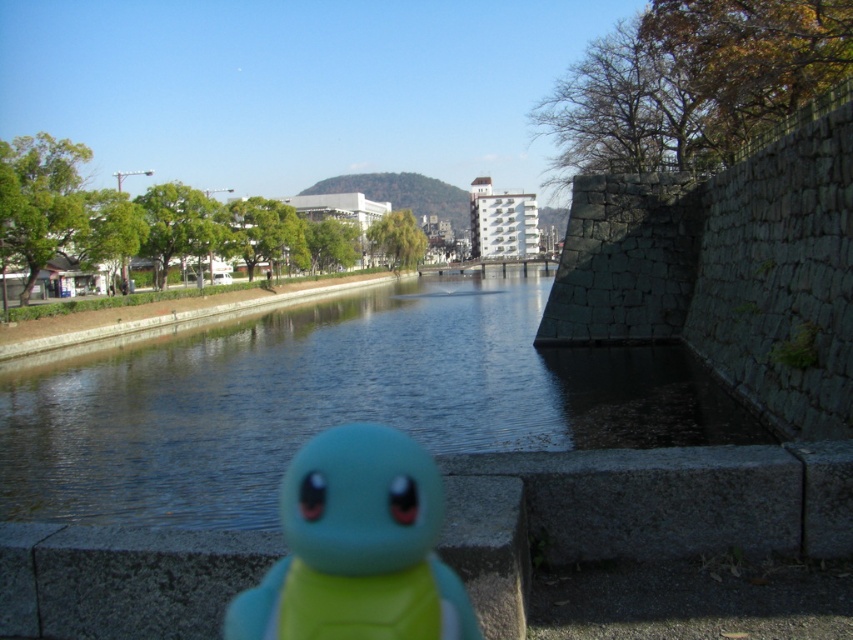
Can you confirm if blue water at center is smaller than teal rubber toy at center?

Incorrect, blue water at center is not smaller in size than teal rubber toy at center.

Is blue water at center taller than teal rubber toy at center?

Correct, blue water at center is much taller as teal rubber toy at center.

Does point (85, 456) come closer to viewer compared to point (393, 595)?

No, (85, 456) is further to viewer.

Image resolution: width=853 pixels, height=640 pixels. I want to click on blue water at center, so click(x=332, y=401).